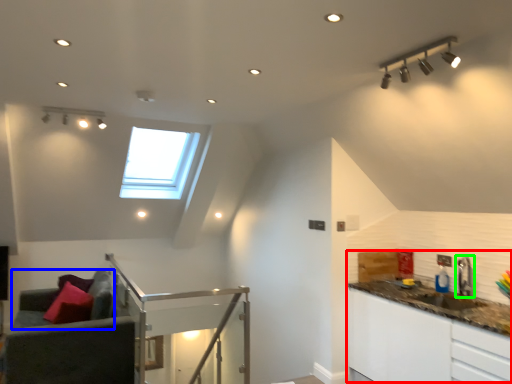
Question: Estimate the real-world distances between objects in this image. Which object is farther from counter top (highlighted by a red box), couch (highlighted by a blue box) or tap (highlighted by a green box)?

Choices:
 (A) couch
 (B) tap

Answer: (A)